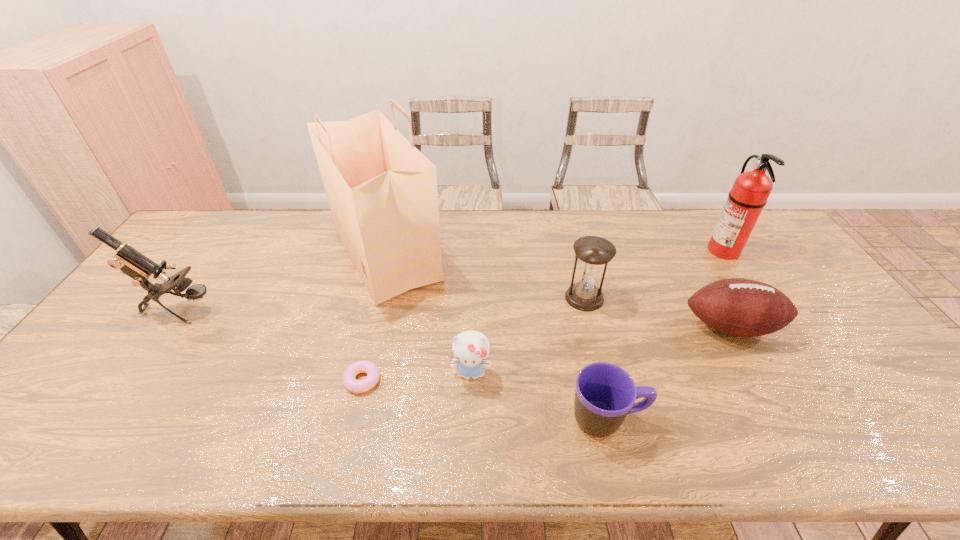
The width and height of the screenshot is (960, 540). Find the location of `vacant region that satisfies the following two spatial constraints: 1. through the eyepiece of the football (American); 2. on the right side of the leftmost object`. vacant region that satisfies the following two spatial constraints: 1. through the eyepiece of the football (American); 2. on the right side of the leftmost object is located at coordinates (168, 327).

Where is `free space that satisfies the following two spatial constraints: 1. on the side of the grocery bag with the superhero design; 2. on the right side of the football (American)`? This screenshot has height=540, width=960. free space that satisfies the following two spatial constraints: 1. on the side of the grocery bag with the superhero design; 2. on the right side of the football (American) is located at coordinates (368, 327).